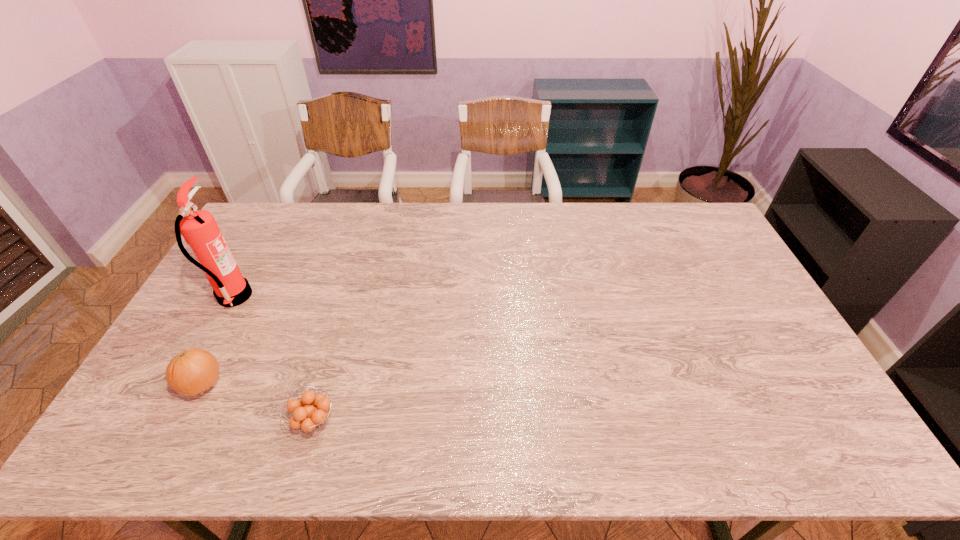
Where is `vacant region that satisfies the following two spatial constraints: 1. on the front side of the taller orange fruit; 2. on the left side of the shortest object`? vacant region that satisfies the following two spatial constraints: 1. on the front side of the taller orange fruit; 2. on the left side of the shortest object is located at coordinates (183, 421).

Image resolution: width=960 pixels, height=540 pixels. In order to click on vacant space that satisfies the following two spatial constraints: 1. with the nozzle aimed from the tallest object; 2. on the left side of the second shortest object in this screenshot , I will do `click(186, 384)`.

Where is `vacant space that satisfies the following two spatial constraints: 1. with the nozzle aimed from the tallest object; 2. on the right side of the second shortest object`? vacant space that satisfies the following two spatial constraints: 1. with the nozzle aimed from the tallest object; 2. on the right side of the second shortest object is located at coordinates (186, 384).

The image size is (960, 540). Find the location of `vacant space that satisfies the following two spatial constraints: 1. with the nozzle aimed from the fire extinguisher; 2. on the back side of the shorter orange fruit`. vacant space that satisfies the following two spatial constraints: 1. with the nozzle aimed from the fire extinguisher; 2. on the back side of the shorter orange fruit is located at coordinates (166, 421).

I want to click on free region that satisfies the following two spatial constraints: 1. on the back side of the taller orange fruit; 2. with the nozzle aimed from the tallest object, so click(x=248, y=297).

Where is `free location that satisfies the following two spatial constraints: 1. with the nozzle aimed from the tallest object; 2. on the back side of the taller orange fruit`? free location that satisfies the following two spatial constraints: 1. with the nozzle aimed from the tallest object; 2. on the back side of the taller orange fruit is located at coordinates (186, 384).

Find the location of `vacant space that satisfies the following two spatial constraints: 1. with the nozzle aimed from the shortest object; 2. on the right side of the tallest object`. vacant space that satisfies the following two spatial constraints: 1. with the nozzle aimed from the shortest object; 2. on the right side of the tallest object is located at coordinates 166,421.

This screenshot has width=960, height=540. I want to click on free region that satisfies the following two spatial constraints: 1. with the nozzle aimed from the tallest object; 2. on the back side of the shortest object, so click(x=166, y=421).

The width and height of the screenshot is (960, 540). Identify the location of free region that satisfies the following two spatial constraints: 1. with the nozzle aimed from the farthest object; 2. on the left side of the rightmost object. (166, 421).

Locate an element on the screen. The image size is (960, 540). vacant space that satisfies the following two spatial constraints: 1. with the nozzle aimed from the taller orange fruit; 2. on the right side of the farthest object is located at coordinates (186, 384).